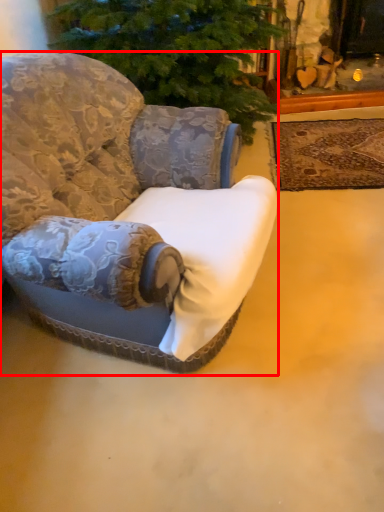
Question: From the image's perspective, considering the relative positions of chair (annotated by the red box) and mat in the image provided, where is chair (annotated by the red box) located with respect to the staircase?

Choices:
 (A) below
 (B) above

Answer: (A)